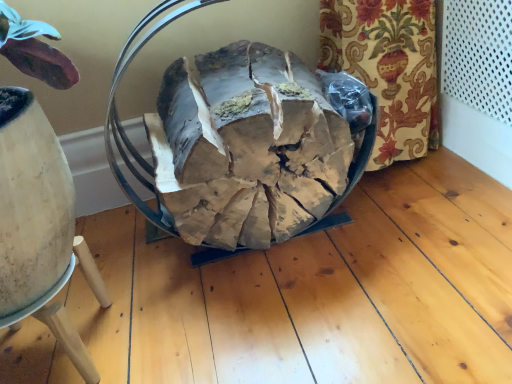
Question: Is wooden stool at lower left situated inside natural wood firewood at center or outside?

Choices:
 (A) inside
 (B) outside

Answer: (B)

Question: Considering the positions of wooden stool at lower left and natural wood firewood at center in the image, is wooden stool at lower left taller or shorter than natural wood firewood at center?

Choices:
 (A) short
 (B) tall

Answer: (A)

Question: In the image, is wooden stool at lower left on the left side or the right side of natural wood firewood at center?

Choices:
 (A) right
 (B) left

Answer: (B)

Question: Considering the positions of natural wood firewood at center and wooden stool at lower left in the image, is natural wood firewood at center wider or thinner than wooden stool at lower left?

Choices:
 (A) thin
 (B) wide

Answer: (B)

Question: Is natural wood firewood at center situated inside wooden stool at lower left or outside?

Choices:
 (A) outside
 (B) inside

Answer: (A)

Question: In terms of size, does natural wood firewood at center appear bigger or smaller than wooden stool at lower left?

Choices:
 (A) small
 (B) big

Answer: (B)

Question: Is natural wood firewood at center in front of or behind wooden stool at lower left in the image?

Choices:
 (A) behind
 (B) front

Answer: (A)